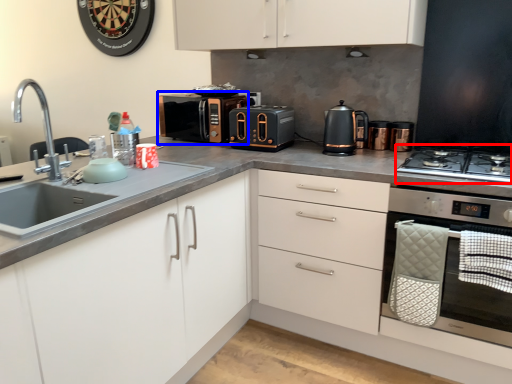
Question: Which object is further to the camera taking this photo, gas stove (highlighted by a red box) or microwave oven (highlighted by a blue box)?

Choices:
 (A) gas stove
 (B) microwave oven

Answer: (B)